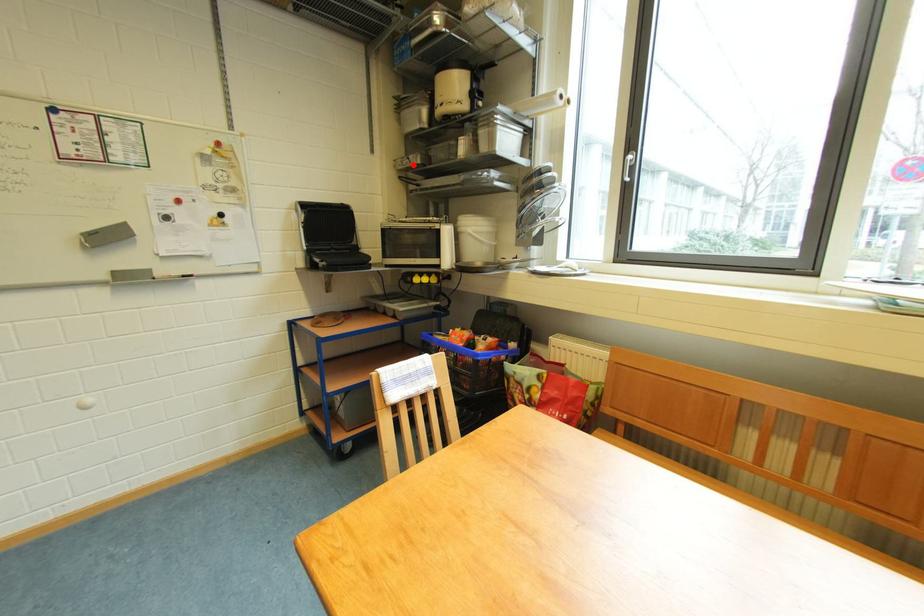
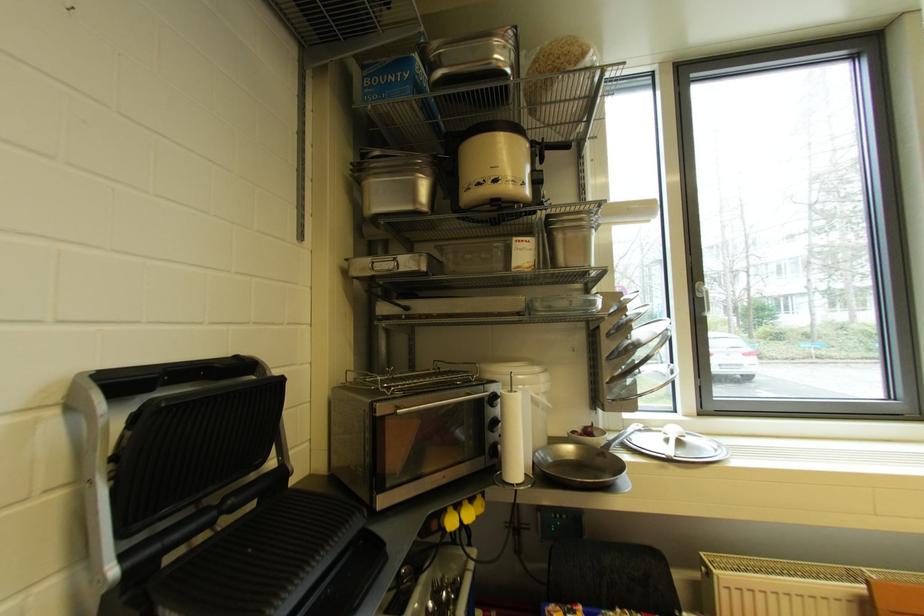
The point at the highlighted location is marked in the first image. Where is the corresponding point in the second image?

(392, 269)